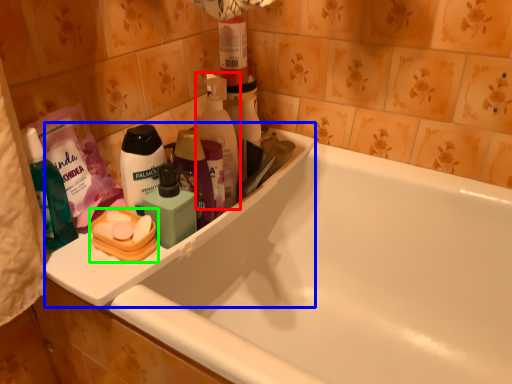
Question: Which object is positioned farthest from cleaning product (highlighted by a red box)? Select from sink (highlighted by a blue box) and personal care (highlighted by a green box).

Choices:
 (A) sink
 (B) personal care

Answer: (B)